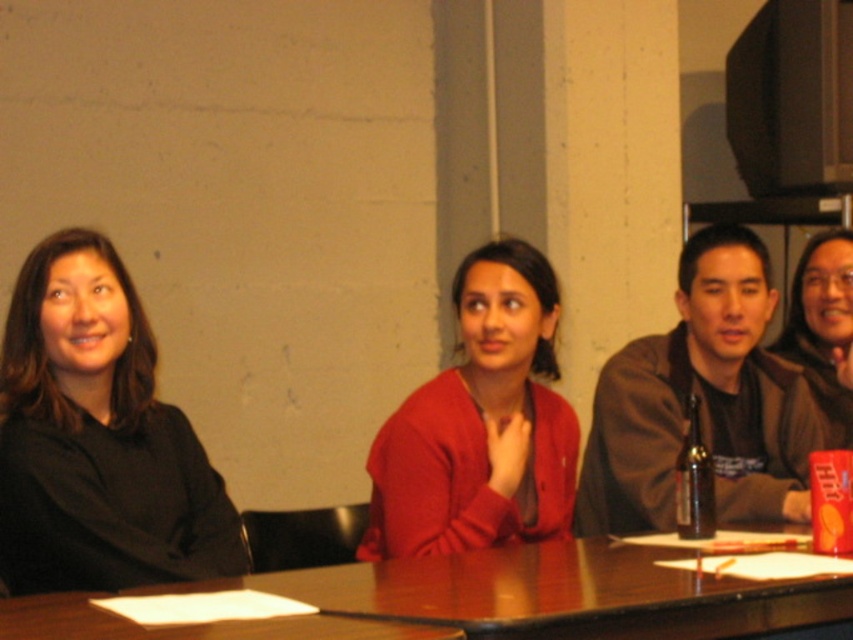
You are a tailor who needs to measure the space between the brown leather jacket at right and the matte black jacket at center. Can you fit a 12 inch ruler between them?

The distance between the brown leather jacket at right and the matte black jacket at center is 14.01 inches, so yes, a 12 inch ruler can fit between them as the space is larger than the ruler.

You are a fashion designer observing the scene. You notice the matte red sweater at center and the orange matte can at center right. Which object is taller?

The matte red sweater at center is taller than the orange matte can at center right.